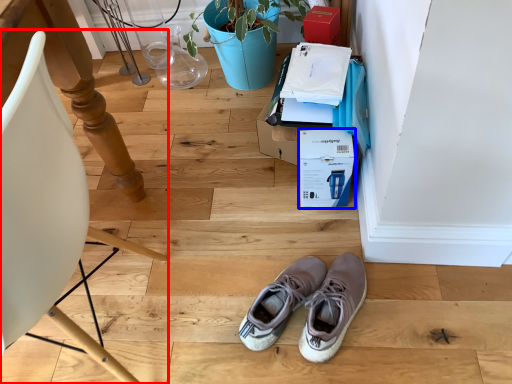
Question: Which of the following is the closest to the observer, chair (highlighted by a red box) or cardboard box (highlighted by a blue box)?

Choices:
 (A) chair
 (B) cardboard box

Answer: (A)